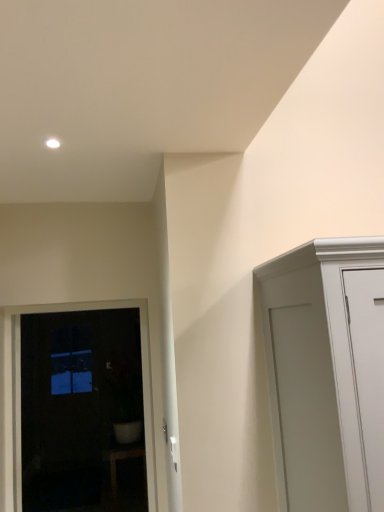
The height and width of the screenshot is (512, 384). What do you see at coordinates (124, 459) in the screenshot? I see `white glossy pot at lower left` at bounding box center [124, 459].

You are a GUI agent. You are given a task and a screenshot of the screen. Output one action in this format:
    pyautogui.click(x=<x>, y=<y>)
    Task: Click on the white glossy pot at lower left
    The width and height of the screenshot is (384, 512).
    Given the screenshot: What is the action you would take?
    pyautogui.click(x=124, y=459)

What is the approximate width of white glossy pot at lower left?

It is 13.97 inches.

Image resolution: width=384 pixels, height=512 pixels. What do you see at coordinates (142, 375) in the screenshot?
I see `dark glass door at left` at bounding box center [142, 375].

At what (x,y) coordinates should I click in order to perform the action: click on dark glass door at left. Please return your answer as a coordinate pair (x, y). Looking at the image, I should click on (142, 375).

Looking at this image, measure the distance between dark glass door at left and camera.

The distance of dark glass door at left from camera is 7.72 feet.

This screenshot has height=512, width=384. In order to click on white glossy pot at lower left in this screenshot , I will do `click(124, 459)`.

Which is more to the right, white glossy pot at lower left or dark glass door at left?

white glossy pot at lower left is more to the right.

Is white glossy pot at lower left further to the viewer compared to dark glass door at left?

Yes, white glossy pot at lower left is further from the camera.

Does point (115, 484) come in front of point (18, 455)?

No, (115, 484) is behind (18, 455).

Consider the image. From the image's perspective, would you say white glossy pot at lower left is shown under dark glass door at left?

Correct, white glossy pot at lower left appears lower than dark glass door at left in the image.

From a real-world perspective, who is located higher, white glossy pot at lower left or dark glass door at left?

In real-world perspective, dark glass door at left is above.

Which object is thinner, white glossy pot at lower left or dark glass door at left?

dark glass door at left is thinner.

Does white glossy pot at lower left have a greater height compared to dark glass door at left?

In fact, white glossy pot at lower left may be shorter than dark glass door at left.

Is white glossy pot at lower left bigger than dark glass door at left?

Indeed, white glossy pot at lower left has a larger size compared to dark glass door at left.

Is white glossy pot at lower left surrounding dark glass door at left?

No, dark glass door at left is not a part of white glossy pot at lower left.

Are white glossy pot at lower left and dark glass door at left far apart?

Yes, white glossy pot at lower left and dark glass door at left are quite far apart.

Is white glossy pot at lower left facing away from dark glass door at left?

No, white glossy pot at lower left is not facing the opposite direction of dark glass door at left.

At what (x,y) coordinates should I click in order to perform the action: click on furniture behind the dark glass door at left. Please return your answer as a coordinate pair (x, y). The width and height of the screenshot is (384, 512). Looking at the image, I should click on pos(124,459).

Considering the positions of objects dark glass door at left and white glossy pot at lower left in the image provided, who is more to the left, dark glass door at left or white glossy pot at lower left?

dark glass door at left.

Who is more distant, dark glass door at left or white glossy pot at lower left?

white glossy pot at lower left.

Is point (14, 347) less distant than point (114, 449)?

Yes, point (14, 347) is closer to viewer.

From the image's perspective, is dark glass door at left located above or below white glossy pot at lower left?

dark glass door at left is above white glossy pot at lower left.

From a real-world perspective, who is located lower, dark glass door at left or white glossy pot at lower left?

From a 3D spatial view, white glossy pot at lower left is below.

Between dark glass door at left and white glossy pot at lower left, which one has larger width?

Wider between the two is white glossy pot at lower left.

Does dark glass door at left have a lesser height compared to white glossy pot at lower left?

In fact, dark glass door at left may be taller than white glossy pot at lower left.

In terms of size, does dark glass door at left appear bigger or smaller than white glossy pot at lower left?

Considering their sizes, dark glass door at left takes up less space than white glossy pot at lower left.

Could white glossy pot at lower left be considered to be inside dark glass door at left?

No, white glossy pot at lower left is not a part of dark glass door at left.

Are dark glass door at left and white glossy pot at lower left far apart?

Yes.

Could you tell me if dark glass door at left is turned towards white glossy pot at lower left?

No, dark glass door at left is not oriented towards white glossy pot at lower left.

What's the angular difference between dark glass door at left and white glossy pot at lower left's facing directions?

The angular difference between dark glass door at left and white glossy pot at lower left is 90.7 degrees.

This screenshot has height=512, width=384. Find the location of `furniture behind the dark glass door at left`. furniture behind the dark glass door at left is located at coordinates (124, 459).

The width and height of the screenshot is (384, 512). I want to click on door that is above the white glossy pot at lower left (from a real-world perspective), so click(142, 375).

The height and width of the screenshot is (512, 384). What are the coordinates of `furniture that appears below the dark glass door at left (from the image's perspective)` in the screenshot? It's located at (124, 459).